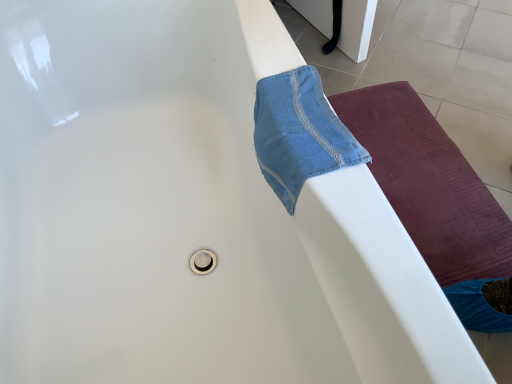
Where is `vacant space situated above maroon textured yoga mat at right (from a real-world perspective)`? The height and width of the screenshot is (384, 512). vacant space situated above maroon textured yoga mat at right (from a real-world perspective) is located at coordinates (425, 163).